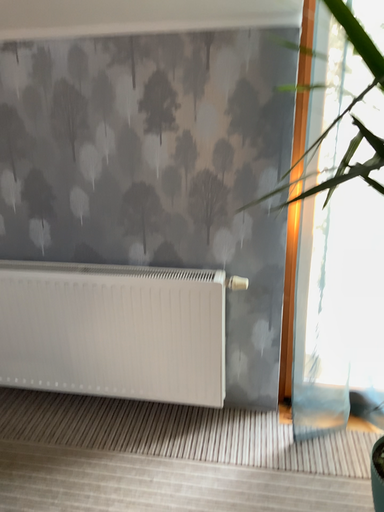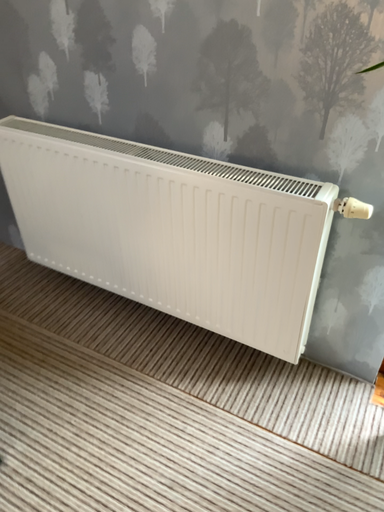
Question: How did the camera likely rotate when shooting the video?

Choices:
 (A) rotated upward
 (B) rotated downward

Answer: (B)